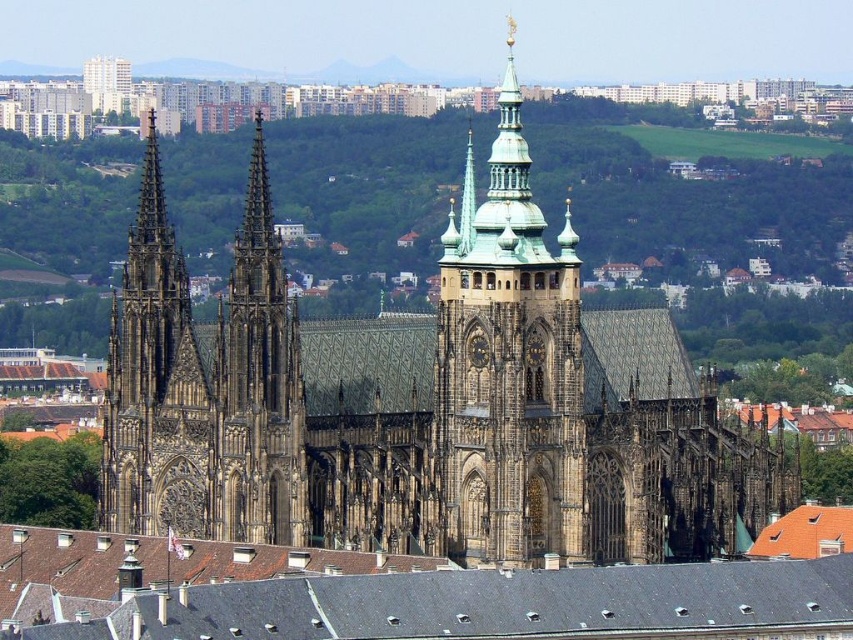
You are a tourist standing at the entrance of the brown stone church at center. You want to take a photo of the dark brown stone tower at center from a distance of 40 feet. Can you position yourself to take the photo without moving further away than necessary?

The brown stone church at center is 39.20 feet from the dark brown stone tower at center. Since the desired distance is 40 feet, you can position yourself just a little bit closer to the tower to achieve the 40 feet distance required for the photo.